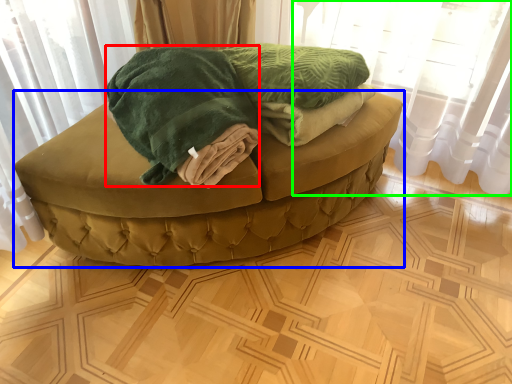
Question: Estimate the real-world distances between objects in this image. Which object is farther from cloth (highlighted by a red box), furniture (highlighted by a blue box) or curtain (highlighted by a green box)?

Choices:
 (A) furniture
 (B) curtain

Answer: (B)